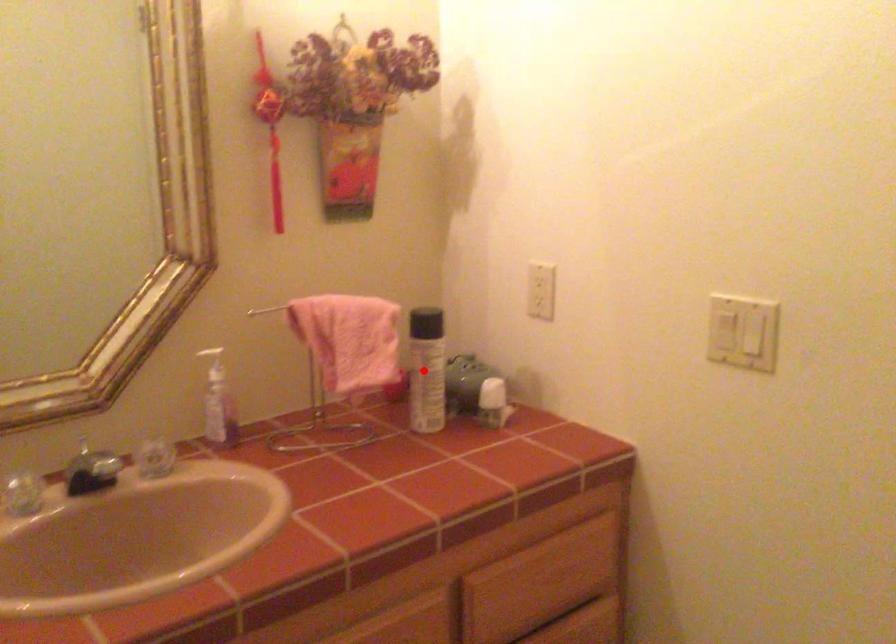
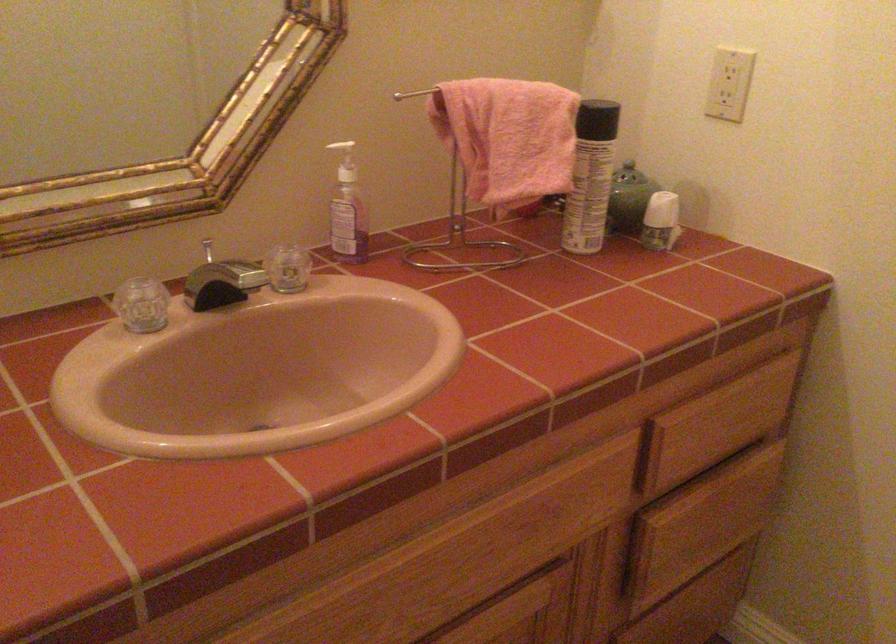
Question: I am providing you with two images of the same scene from different viewpoints. Image1 has a red point marked. In image2, the corresponding 3D location appears at what relative position? Reply with the corresponding letter.

Choices:
 (A) Closer
 (B) Farther

Answer: (A)